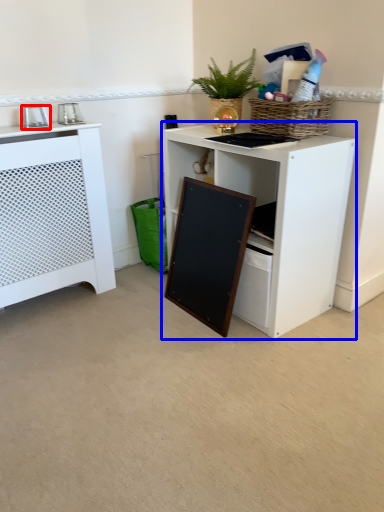
Question: Which object appears closest to the camera in this image, appliance (highlighted by a red box) or desk (highlighted by a blue box)?

Choices:
 (A) appliance
 (B) desk

Answer: (B)